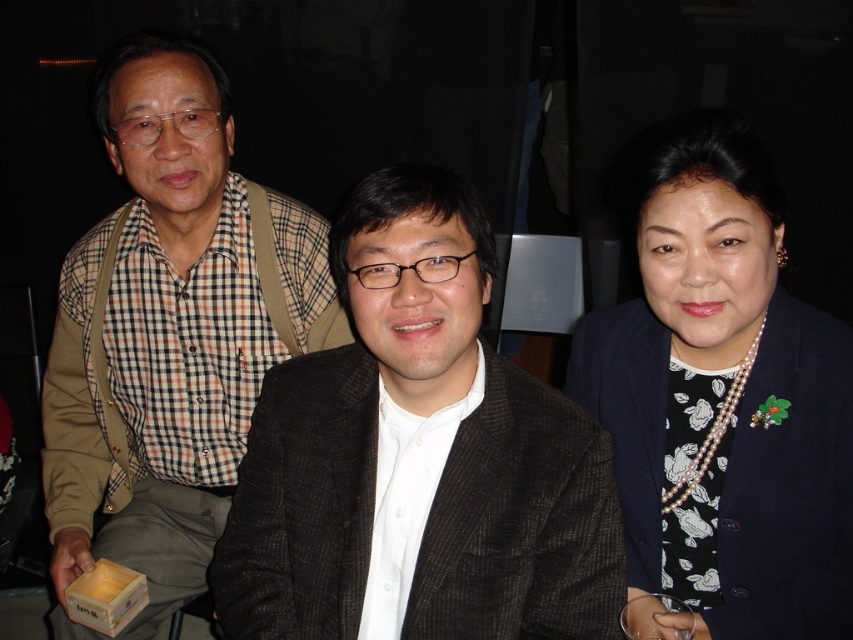
Question: Which of the following is the farthest from the observer?

Choices:
 (A) (839, 620)
 (B) (718, 413)
 (C) (469, 474)

Answer: (B)

Question: Which object is positioned closest to the brown checkered shirt at left?

Choices:
 (A) pearl necklace at right
 (B) dark brown textured blazer at center
 (C) navy blue blazer at center

Answer: (B)

Question: Does dark brown textured blazer at center appear on the right side of brown checkered shirt at left?

Choices:
 (A) yes
 (B) no

Answer: (A)

Question: Which object is closer to the camera taking this photo?

Choices:
 (A) brown checkered shirt at left
 (B) pearl necklace at right

Answer: (B)

Question: Can you confirm if navy blue blazer at center is bigger than pearl necklace at right?

Choices:
 (A) yes
 (B) no

Answer: (A)

Question: Does navy blue blazer at center appear on the left side of pearl necklace at right?

Choices:
 (A) yes
 (B) no

Answer: (A)